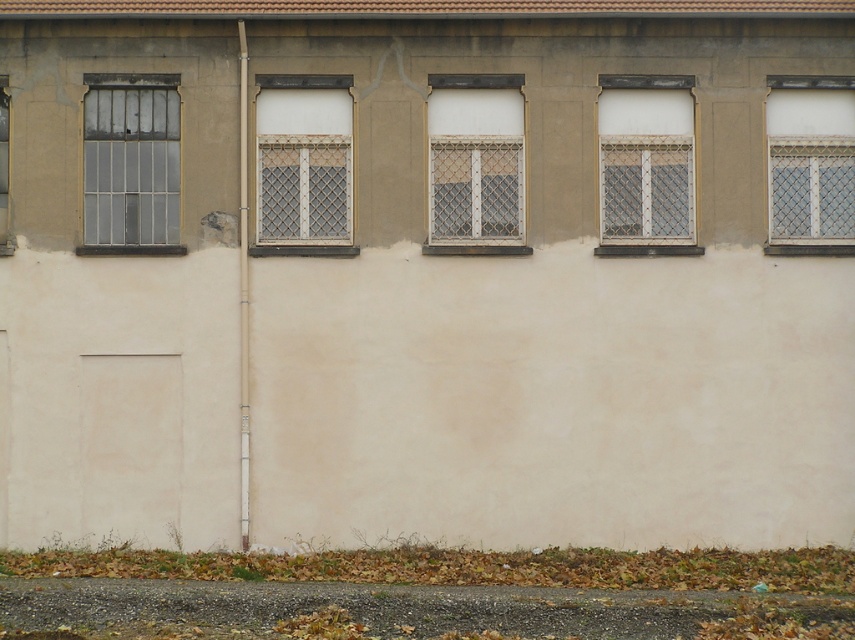
You are standing in front of the building and need to locate the white textured window at center right and the matte glass window at left. According to the scene description, which window is positioned higher on the wall?

The white textured window at center right is located above the matte glass window at left, so it is positioned higher on the wall.

You are standing outside the building and want to look through the clear glass window at left. Can you see through it clearly from your current position, considering the white mesh screen at upper right?

The clear glass window at left is behind the white mesh screen at upper right, so the mesh screen would block your view of the clear glass window at left from the outside.

You are standing in front of the building exterior described. There is a matte white lattice at center. Can you estimate its position using a coordinate system where the bottom left corner of the wall is the origin point?

The matte white lattice at center is located at coordinates approximately 0.258 along the horizontal axis and 0.557 along the vertical axis, using the bottom left corner as the origin point.